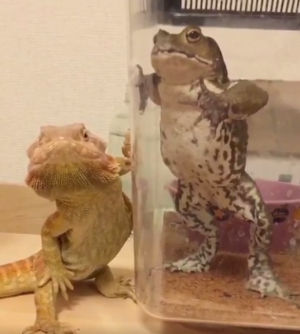
Find the location of `wall to left of tank`. wall to left of tank is located at coordinates (62, 36).